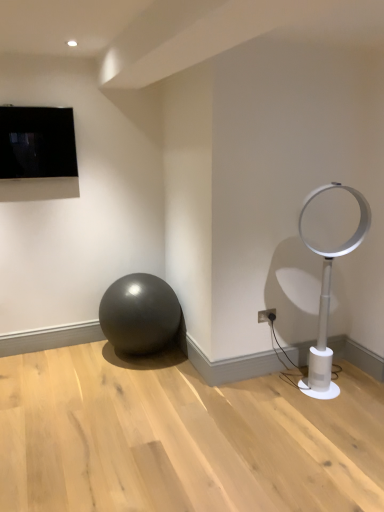
Question: Is white plastic electric outlet at lower right turned away from black glossy tv at upper left?

Choices:
 (A) no
 (B) yes

Answer: (A)

Question: Is white plastic electric outlet at lower right facing towards black glossy tv at upper left?

Choices:
 (A) yes
 (B) no

Answer: (B)

Question: Is white plastic electric outlet at lower right positioned beyond the bounds of black glossy tv at upper left?

Choices:
 (A) no
 (B) yes

Answer: (B)

Question: Considering the relative positions of white plastic electric outlet at lower right and black glossy tv at upper left in the image provided, is white plastic electric outlet at lower right behind black glossy tv at upper left?

Choices:
 (A) no
 (B) yes

Answer: (B)

Question: Can you confirm if white plastic electric outlet at lower right is thinner than black glossy tv at upper left?

Choices:
 (A) no
 (B) yes

Answer: (B)

Question: From a real-world perspective, is white plastic electric outlet at lower right physically located above or below black glossy tv at upper left?

Choices:
 (A) below
 (B) above

Answer: (A)

Question: Is white plastic electric outlet at lower right taller or shorter than black glossy tv at upper left?

Choices:
 (A) short
 (B) tall

Answer: (A)

Question: Would you say white plastic electric outlet at lower right is inside or outside black glossy tv at upper left?

Choices:
 (A) outside
 (B) inside

Answer: (A)

Question: Considering the positions of point (261, 320) and point (44, 156), is point (261, 320) closer or farther from the camera than point (44, 156)?

Choices:
 (A) farther
 (B) closer

Answer: (B)

Question: In terms of size, does white plastic fan at right appear bigger or smaller than black glossy tv at upper left?

Choices:
 (A) big
 (B) small

Answer: (A)

Question: From the image's perspective, is white plastic fan at right located above or below black glossy tv at upper left?

Choices:
 (A) above
 (B) below

Answer: (B)

Question: From a real-world perspective, is white plastic fan at right physically located above or below black glossy tv at upper left?

Choices:
 (A) above
 (B) below

Answer: (B)

Question: In terms of width, does white plastic fan at right look wider or thinner when compared to black glossy tv at upper left?

Choices:
 (A) wide
 (B) thin

Answer: (A)

Question: Is black glossy tv at upper left taller or shorter than white plastic fan at right?

Choices:
 (A) tall
 (B) short

Answer: (B)

Question: Looking at the image, does black glossy tv at upper left seem bigger or smaller compared to white plastic fan at right?

Choices:
 (A) big
 (B) small

Answer: (B)